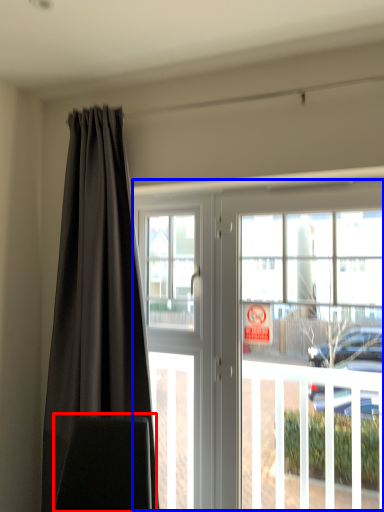
Question: Which object appears closest to the camera in this image, swivel chair (highlighted by a red box) or door (highlighted by a blue box)?

Choices:
 (A) swivel chair
 (B) door

Answer: (A)